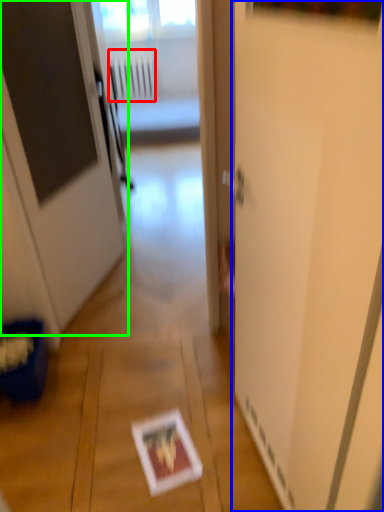
Question: Which is nearer to the radiator (highlighted by a red box)? screen door (highlighted by a blue box) or door (highlighted by a green box).

Choices:
 (A) screen door
 (B) door

Answer: (B)